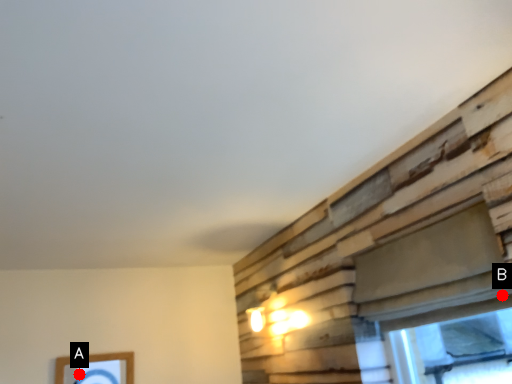
Question: Two points are circled on the image, labeled by A and B beside each circle. Which point appears closest to the camera in this image?

Choices:
 (A) A is closer
 (B) B is closer

Answer: (B)